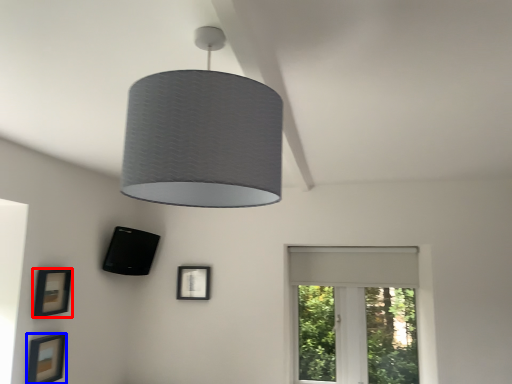
Question: Which object is further to the camera taking this photo, picture frame (highlighted by a red box) or picture frame (highlighted by a blue box)?

Choices:
 (A) picture frame
 (B) picture frame

Answer: (A)